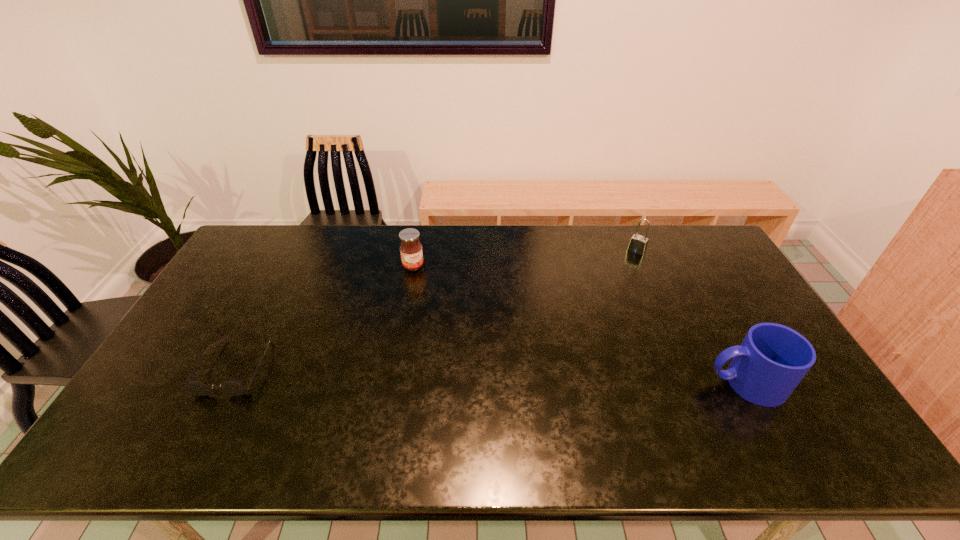
Find the location of `free space between the second object from left to right and the padlock`. free space between the second object from left to right and the padlock is located at coordinates (525, 259).

Image resolution: width=960 pixels, height=540 pixels. I want to click on vacant space in between the mug and the second farthest object, so click(579, 325).

Locate an element on the screen. This screenshot has height=540, width=960. unoccupied position between the second object from left to right and the leftmost object is located at coordinates (324, 316).

The width and height of the screenshot is (960, 540). I want to click on vacant space in between the padlock and the second farthest object, so click(525, 259).

Identify the location of free space that is in between the farthest object and the mug. (691, 317).

Locate an element on the screen. Image resolution: width=960 pixels, height=540 pixels. free space between the second farthest object and the mug is located at coordinates pyautogui.click(x=579, y=325).

Locate an element on the screen. This screenshot has width=960, height=540. free space between the mug and the sunglasses is located at coordinates (491, 375).

Identify the location of free space between the second object from left to right and the farthest object. The height and width of the screenshot is (540, 960). (525, 259).

At what (x,y) coordinates should I click in order to perform the action: click on object that is the closest to the second object from left to right. Please return your answer as a coordinate pair (x, y). Looking at the image, I should click on (234, 387).

Locate an element on the screen. object that is the third nearest to the second farthest object is located at coordinates tap(772, 360).